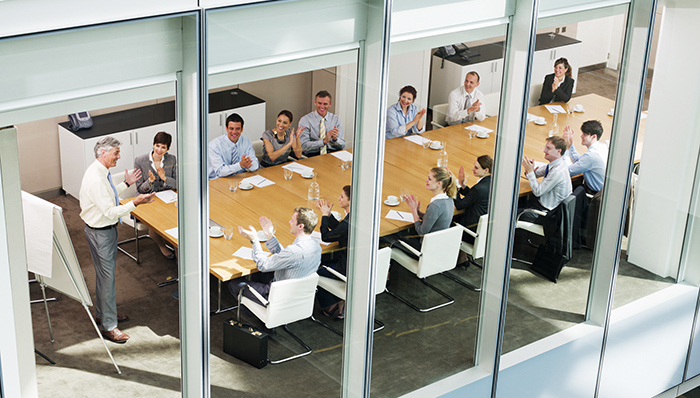
Where is `office chairs`? Image resolution: width=700 pixels, height=398 pixels. office chairs is located at coordinates (119, 177), (438, 111), (491, 101), (594, 197), (532, 224), (477, 241), (438, 259), (379, 273), (304, 296).